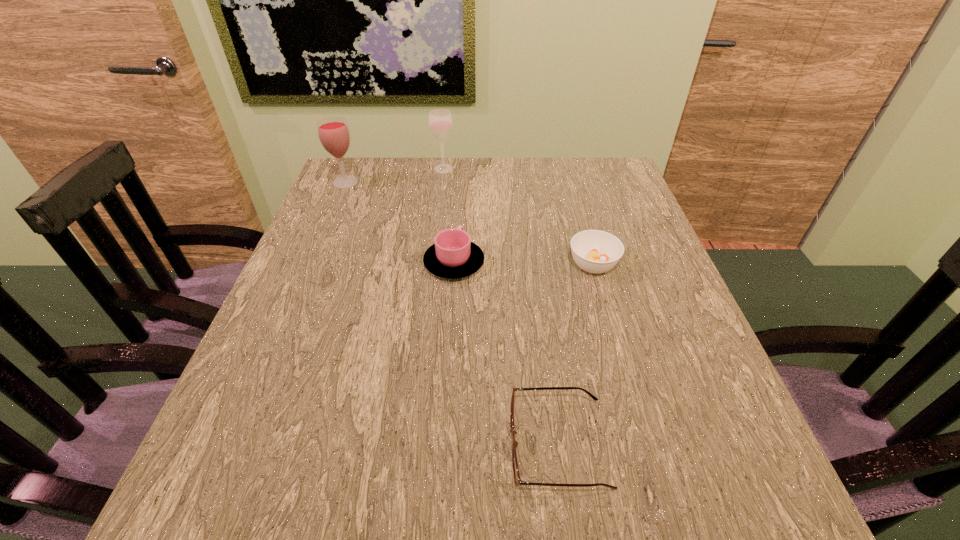
Find the location of a particular element. This screenshot has height=540, width=960. object present at the right edge is located at coordinates (594, 251).

Where is `object at the far left corner`? object at the far left corner is located at coordinates (333, 132).

This screenshot has height=540, width=960. I want to click on vacant space at the far edge of the desktop, so click(x=504, y=201).

You are a GUI agent. You are given a task and a screenshot of the screen. Output one action in this format:
    pyautogui.click(x=<x>, y=<y>)
    Task: Click on the vacant area at the near edge of the desktop
    The image size is (960, 540).
    Given the screenshot: What is the action you would take?
    coord(530,479)

Locate an element on the screen. Image resolution: width=960 pixels, height=540 pixels. free location at the left edge is located at coordinates (303, 355).

Locate an element on the screen. vacant space at the right edge of the desktop is located at coordinates (650, 235).

This screenshot has width=960, height=540. In the image, there is a desktop. Identify the location of vacant space at the far left corner. (337, 201).

At what (x,y) coordinates should I click in order to perform the action: click on vacant space at the far right corner of the desktop. Please return your answer as a coordinate pair (x, y). Image resolution: width=960 pixels, height=540 pixels. Looking at the image, I should click on (576, 202).

Locate an element on the screen. The width and height of the screenshot is (960, 540). unoccupied area between the cup and the left wineglass is located at coordinates (399, 223).

The height and width of the screenshot is (540, 960). Find the location of `free point between the rightmost object and the fourth nearest object`. free point between the rightmost object and the fourth nearest object is located at coordinates (469, 224).